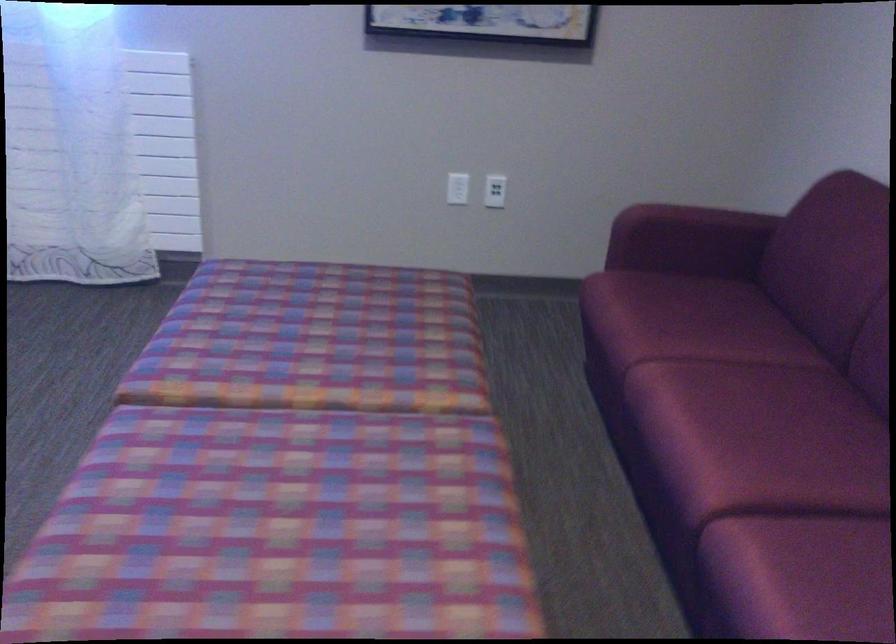
You are a GUI agent. You are given a task and a screenshot of the screen. Output one action in this format:
    pyautogui.click(x=<x>, y=<y>)
    Task: Click on the sofa sitting surface
    
    Given the screenshot: What is the action you would take?
    pyautogui.click(x=764, y=456)